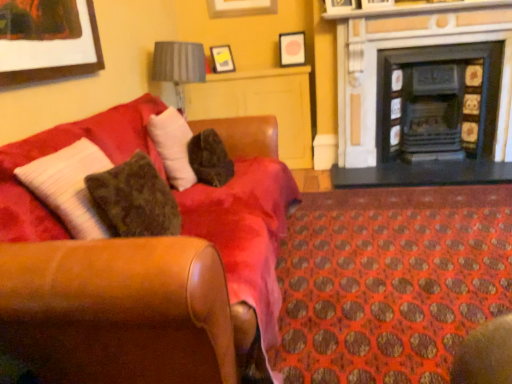
Question: Does matte wooden picture frame at upper center, which ranks as the first picture frame in top-to-bottom order, have a greater width compared to gray fabric lampshade at upper center?

Choices:
 (A) no
 (B) yes

Answer: (A)

Question: Is matte wooden picture frame at upper center, which appears as the 3th picture frame when ordered from the bottom, smaller than gray fabric lampshade at upper center?

Choices:
 (A) no
 (B) yes

Answer: (B)

Question: Can you confirm if matte wooden picture frame at upper center, which ranks as the first picture frame in top-to-bottom order, is positioned to the left of gray fabric lampshade at upper center?

Choices:
 (A) no
 (B) yes

Answer: (A)

Question: Is matte wooden picture frame at upper center, which appears as the 3th picture frame when ordered from the bottom, next to gray fabric lampshade at upper center?

Choices:
 (A) no
 (B) yes

Answer: (A)

Question: Considering the relative positions of matte wooden picture frame at upper center, which appears as the 3th picture frame when ordered from the bottom, and gray fabric lampshade at upper center in the image provided, is matte wooden picture frame at upper center, which appears as the 3th picture frame when ordered from the bottom, to the right of gray fabric lampshade at upper center from the viewer's perspective?

Choices:
 (A) yes
 (B) no

Answer: (A)

Question: Is matte wooden picture frame at upper center, which appears as the 3th picture frame when ordered from the bottom, further to the viewer compared to gray fabric lampshade at upper center?

Choices:
 (A) no
 (B) yes

Answer: (B)

Question: Considering the relative sizes of matte black picture frame at upper center, arranged as the second picture frame when viewed from the top, and matte wooden picture frame at upper center, which appears as the 3th picture frame when ordered from the bottom, in the image provided, is matte black picture frame at upper center, arranged as the second picture frame when viewed from the top, bigger than matte wooden picture frame at upper center, which appears as the 3th picture frame when ordered from the bottom,?

Choices:
 (A) yes
 (B) no

Answer: (B)

Question: Is matte black picture frame at upper center, arranged as the second picture frame when viewed from the top, at the left side of matte wooden picture frame at upper center, which appears as the 3th picture frame when ordered from the bottom?

Choices:
 (A) no
 (B) yes

Answer: (A)

Question: From a real-world perspective, is matte black picture frame at upper center, arranged as the second picture frame when viewed from the top, on matte wooden picture frame at upper center, which appears as the 3th picture frame when ordered from the bottom?

Choices:
 (A) yes
 (B) no

Answer: (B)

Question: From the image's perspective, is matte black picture frame at upper center, arranged as the second picture frame when viewed from the top, below matte wooden picture frame at upper center, which appears as the 3th picture frame when ordered from the bottom?

Choices:
 (A) yes
 (B) no

Answer: (A)

Question: Is matte black picture frame at upper center, which is the second picture frame from bottom to top, thinner than matte wooden picture frame at upper center, which appears as the 3th picture frame when ordered from the bottom?

Choices:
 (A) no
 (B) yes

Answer: (A)

Question: Is matte black picture frame at upper center, arranged as the second picture frame when viewed from the top, shorter than matte wooden picture frame at upper center, which appears as the 3th picture frame when ordered from the bottom?

Choices:
 (A) no
 (B) yes

Answer: (A)

Question: Is fuzzy brown pillow at center closer to the viewer compared to black matte fireplace at right, the 1th fireplace from the right?

Choices:
 (A) no
 (B) yes

Answer: (B)